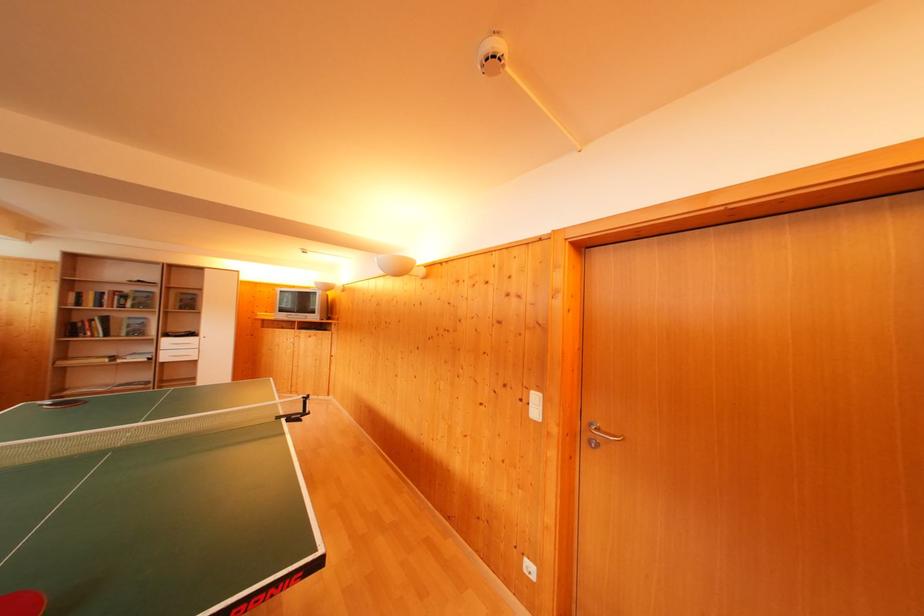
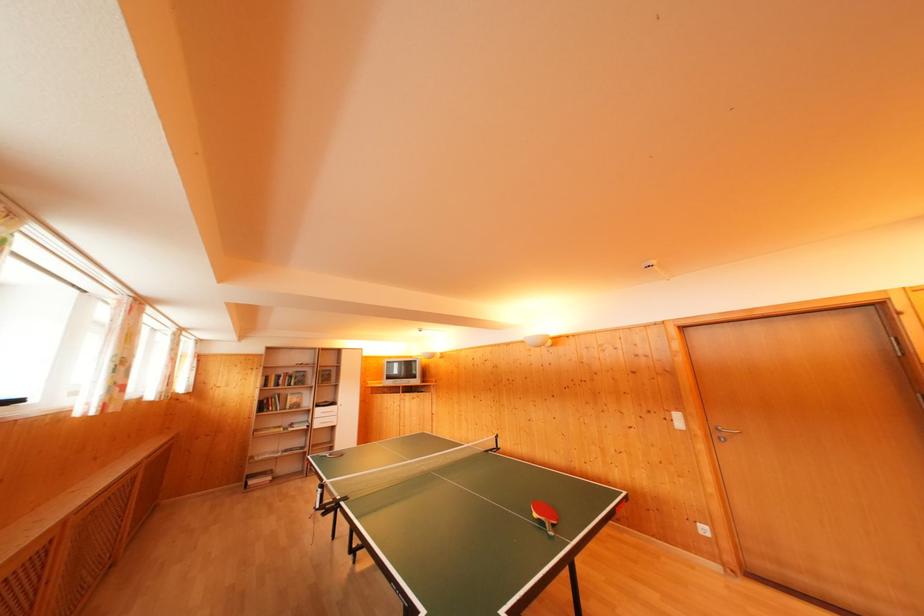
Locate, in the second image, the point that corresponds to point (112, 294) in the first image.

(286, 377)